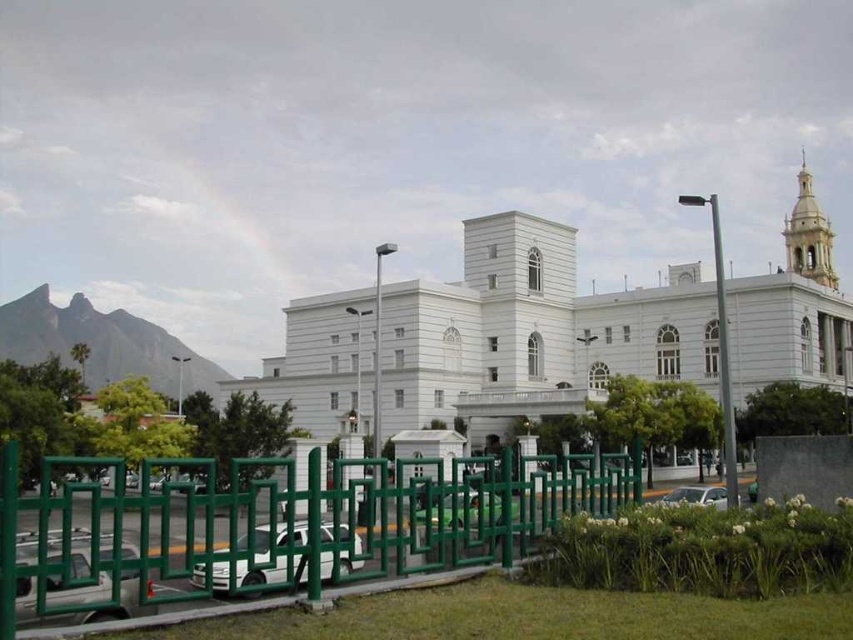
Question: Does white smooth building at center lie behind green metal fence at lower center?

Choices:
 (A) yes
 (B) no

Answer: (A)

Question: Which object is closer to the camera taking this photo?

Choices:
 (A) white smooth building at center
 (B) green metal fence at lower center

Answer: (B)

Question: From the image, what is the correct spatial relationship of white smooth building at center in relation to green metal fence at lower center?

Choices:
 (A) left
 (B) right

Answer: (B)

Question: Can you confirm if white smooth building at center is smaller than green metal fence at lower center?

Choices:
 (A) no
 (B) yes

Answer: (A)